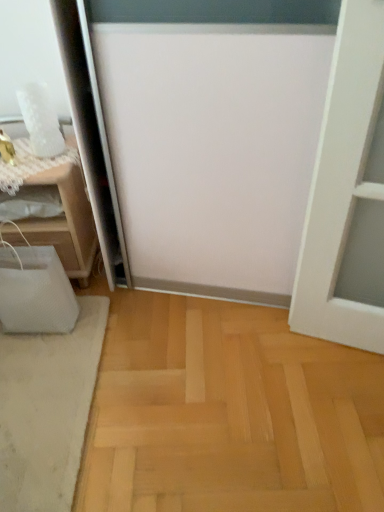
What are the coordinates of `free space to the right of white soft rug at lower left` in the screenshot? It's located at (183, 385).